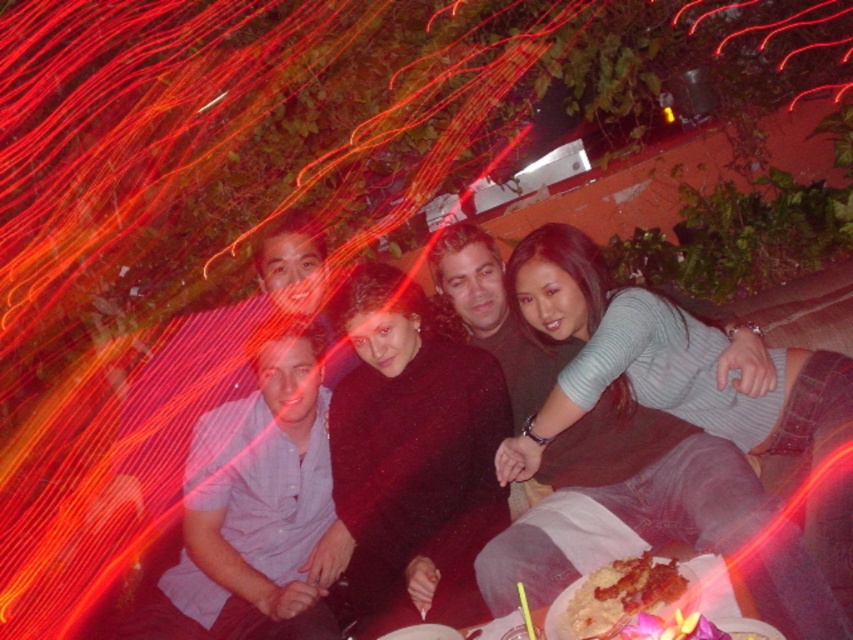
Question: Which point appears farthest from the camera in this image?

Choices:
 (A) (582, 260)
 (B) (612, 612)

Answer: (A)

Question: Observing the image, what is the correct spatial positioning of light blue sweater at center in reference to golden crispy chicken at lower center?

Choices:
 (A) above
 (B) below

Answer: (A)

Question: Does light blue sweater at center have a smaller size compared to golden crispy chicken at lower center?

Choices:
 (A) yes
 (B) no

Answer: (B)

Question: Can you confirm if light blue sweater at center is smaller than golden crispy chicken at lower center?

Choices:
 (A) no
 (B) yes

Answer: (A)